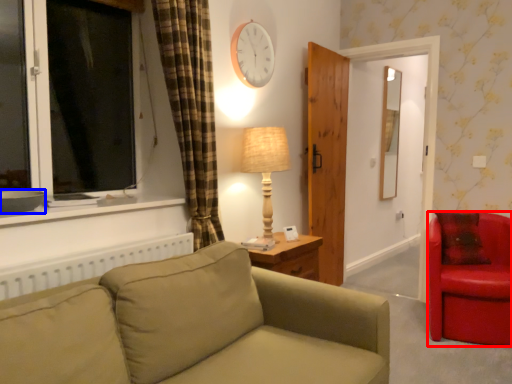
Question: Which object appears closest to the camera in this image, chair (highlighted by a red box) or bowl (highlighted by a blue box)?

Choices:
 (A) chair
 (B) bowl

Answer: (B)